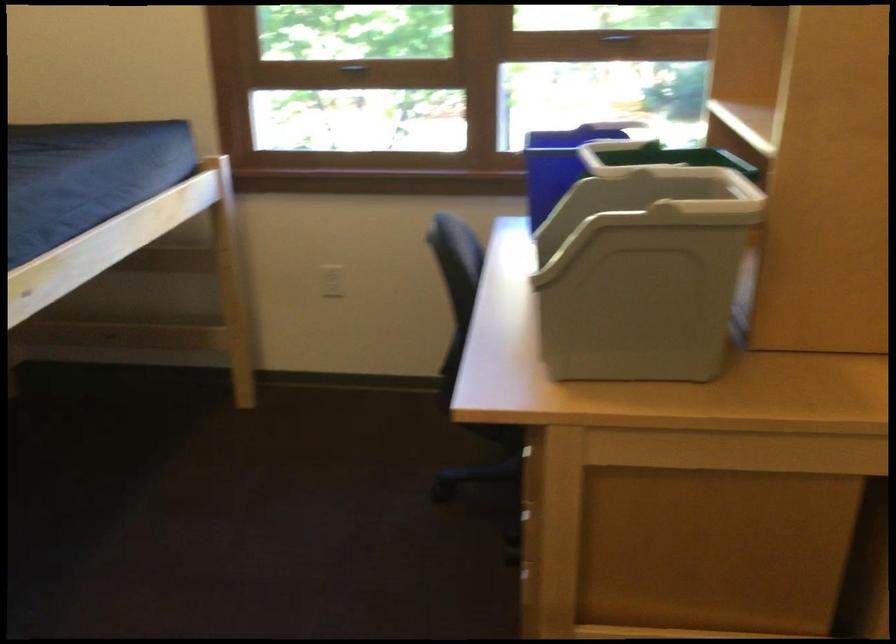
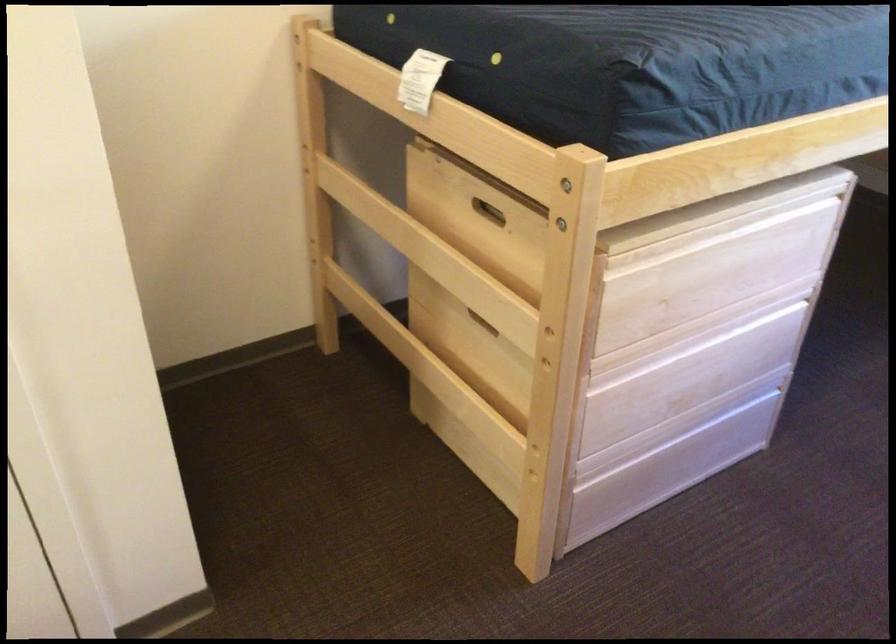
Looking at this image, how did the camera likely rotate?

The rotation direction of the camera is left-down.